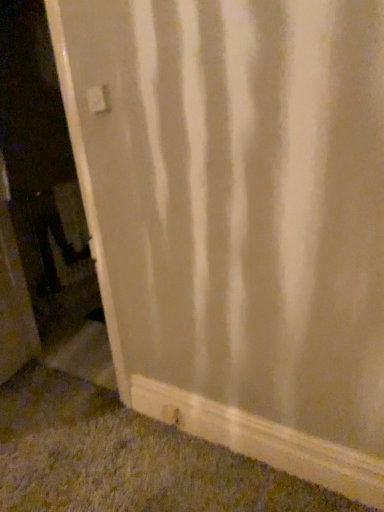
Identify the location of transparent plastic screen door at left. (51, 194).

This screenshot has width=384, height=512. Describe the element at coordinates (51, 194) in the screenshot. I see `transparent plastic screen door at left` at that location.

Where is `transparent plastic screen door at left`? Image resolution: width=384 pixels, height=512 pixels. transparent plastic screen door at left is located at coordinates (51, 194).